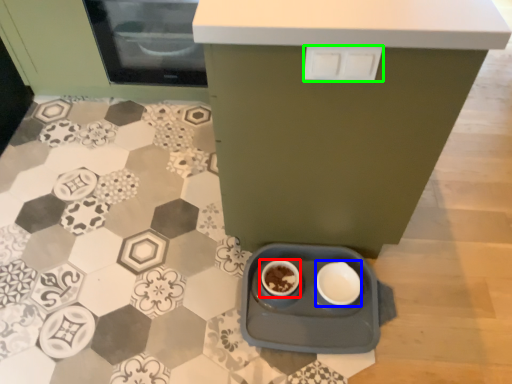
Question: Which object is the farthest from coffee cup (highlighted by a red box)? Choose among these: bowl (highlighted by a blue box) or drawer (highlighted by a green box).

Choices:
 (A) bowl
 (B) drawer

Answer: (B)